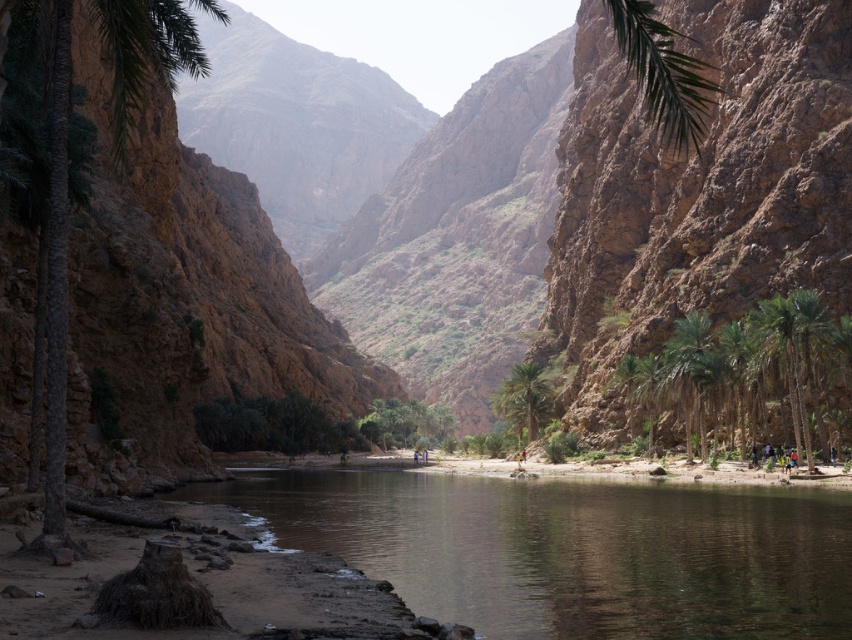
You are a hiker standing at the edge of the canyon looking towards the river. You notice the brown rough rock at upper right in the distance. If your binoculars have a maximum viewing range of 70 meters, will you be able to see the rock clearly with them?

The brown rough rock at upper right is 71.80 meters away from the viewer. Since the binoculars have a maximum viewing range of 70 meters, you will not be able to see the rock clearly with them.